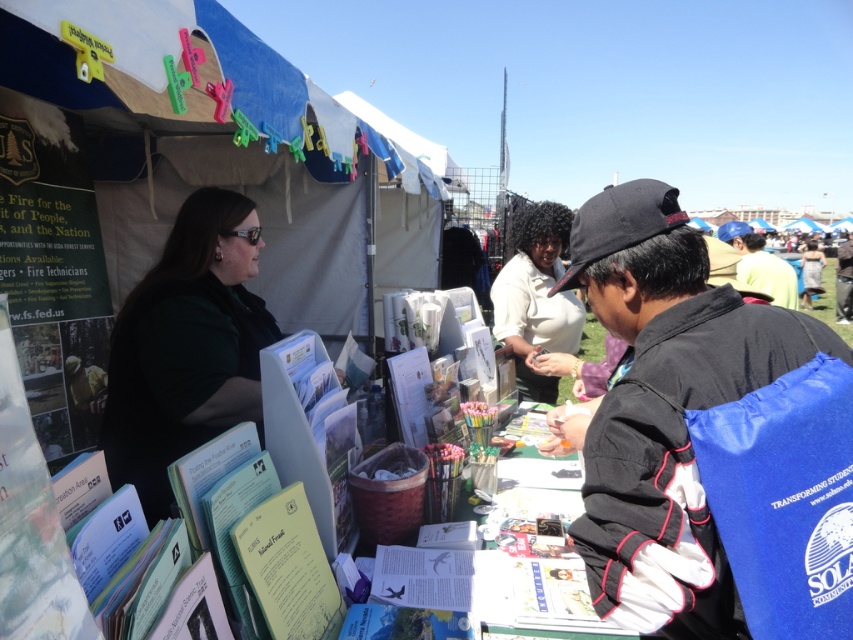
Who is taller, white glossy shirt at center or blue fabric backpack at center?

white glossy shirt at center is taller.

This screenshot has height=640, width=853. I want to click on white glossy shirt at center, so point(535,296).

Who is more distant from viewer, (x=573, y=300) or (x=755, y=262)?

Point (x=755, y=262)

What are the coordinates of `white glossy shirt at center` in the screenshot? It's located at (535, 296).

Which is below, white glossy shirt at center or black fabric backpack at lower right?

white glossy shirt at center is lower down.

Describe the element at coordinates (535, 296) in the screenshot. I see `white glossy shirt at center` at that location.

Identify the location of white glossy shirt at center. (535, 296).

Is black fabric jacket at lower right further to camera compared to black fabric backpack at lower right?

That is False.

Does black fabric jacket at lower right have a lesser width compared to black fabric backpack at lower right?

Indeed, black fabric jacket at lower right has a lesser width compared to black fabric backpack at lower right.

Where is `black fabric jacket at lower right`? black fabric jacket at lower right is located at coordinates (706, 440).

In order to click on black fabric jacket at lower right in this screenshot , I will do `click(706, 440)`.